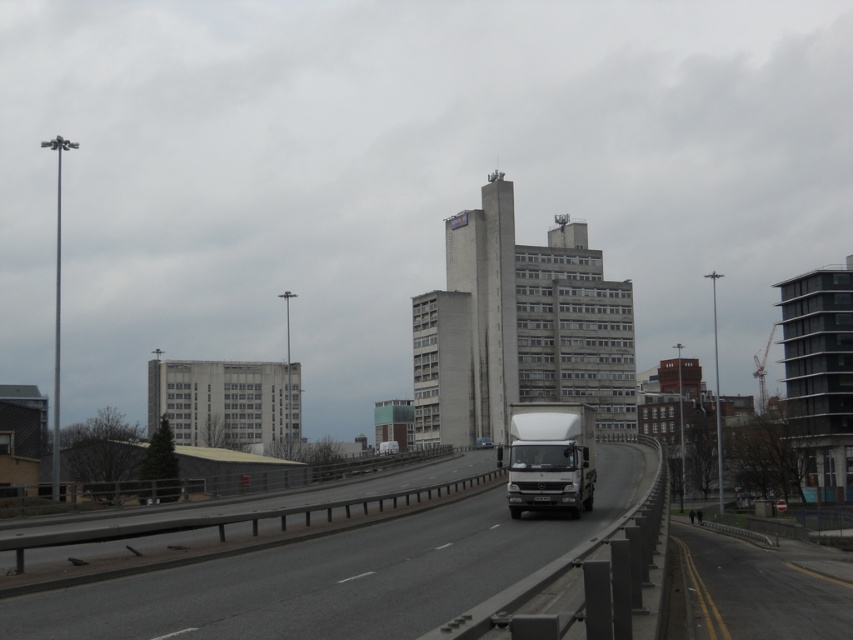
Question: Does white matte trailer truck at center appear on the left side of matte white van at center?

Choices:
 (A) yes
 (B) no

Answer: (A)

Question: Which point is farther from the camera taking this photo?

Choices:
 (A) (492, 584)
 (B) (483, 442)

Answer: (B)

Question: Is smooth asphalt highway at center further to camera compared to matte white van at center?

Choices:
 (A) yes
 (B) no

Answer: (B)

Question: Can you confirm if smooth asphalt highway at center is bigger than white matte trailer truck at center?

Choices:
 (A) yes
 (B) no

Answer: (A)

Question: Which is farther from the smooth asphalt highway at center?

Choices:
 (A) matte white van at center
 (B) white matte trailer truck at center

Answer: (A)

Question: Among these points, which one is nearest to the camera?

Choices:
 (A) (463, 538)
 (B) (521, 442)
 (C) (488, 442)

Answer: (A)